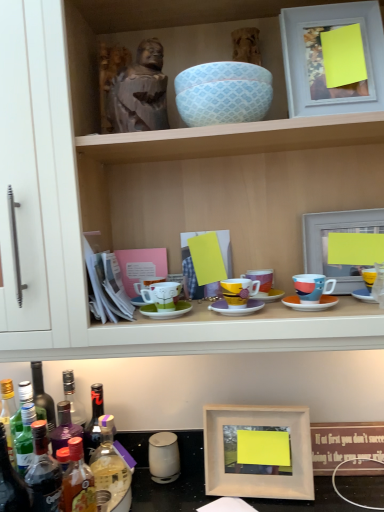
Find the location of `matte ceramic mug at right, which ranks as the 4th coffee cup in left-to-right order`. matte ceramic mug at right, which ranks as the 4th coffee cup in left-to-right order is located at coordinates (312, 287).

Describe the element at coordinates (112, 468) in the screenshot. This screenshot has height=512, width=384. I see `translucent plastic bottle at lower left, the first bottle viewed from the right` at that location.

Locate an element on the screen. wooden picture frame at right, the 3th picture frame in the bottom-to-top sequence is located at coordinates (343, 246).

Image resolution: width=384 pixels, height=512 pixels. What do you see at coordinates (220, 74) in the screenshot? I see `blue patterned bowl at upper center, the 2th bowl ordered from the bottom` at bounding box center [220, 74].

Measure the distance between purple matte saucer at center, marked as the 2th saucer in a right-to-left arrangement, and camera.

The depth of purple matte saucer at center, marked as the 2th saucer in a right-to-left arrangement, is 33.64 inches.

What is the approximate height of white glossy saucer at center, which is the third saucer from left to right?

white glossy saucer at center, which is the third saucer from left to right, is 0.48 inches in height.

At what (x,y) coordinates should I click in order to perform the action: click on white glossy saucer at center, marked as the 1th saucer in a right-to-left arrangement. Please return your answer as a coordinate pair (x, y). This screenshot has width=384, height=512. Looking at the image, I should click on (310, 303).

This screenshot has height=512, width=384. Describe the element at coordinates (231, 184) in the screenshot. I see `wooden statue at upper center` at that location.

Identify the location of matte ceramic mug at right, which ranks as the 4th coffee cup in left-to-right order. The height and width of the screenshot is (512, 384). (312, 287).

From a real-world perspective, which object stands above the other?

green matte coffee cup at center, the 4th coffee cup viewed from the right, is physically above.

Which object is wider, green matte coffee cup at center, the 4th coffee cup viewed from the right, or translucent plastic bottle at lower left, which is the 2th bottle from right to left?

Wider between the two is green matte coffee cup at center, the 4th coffee cup viewed from the right.

Is green matte coffee cup at center, the 1th coffee cup positioned from the left, inside or outside of translucent plastic bottle at lower left, which is the 2th bottle from right to left?

green matte coffee cup at center, the 1th coffee cup positioned from the left, is not inside translucent plastic bottle at lower left, which is the 2th bottle from right to left, it's outside.

Does green matte coffee cup at center, the 1th coffee cup positioned from the left, have a larger size compared to translucent plastic bottle at lower left, the 3th bottle when ordered from left to right?

Actually, green matte coffee cup at center, the 1th coffee cup positioned from the left, might be smaller than translucent plastic bottle at lower left, the 3th bottle when ordered from left to right.

Where is `the 2nd coffee cup positioned above the matte ceramic coffee cup at center, placed as the second coffee cup when sorted from left to right (from the image's perspective)`? This screenshot has height=512, width=384. the 2nd coffee cup positioned above the matte ceramic coffee cup at center, placed as the second coffee cup when sorted from left to right (from the image's perspective) is located at coordinates (261, 278).

Based on their sizes in the image, would you say matte ceramic coffee cup at center, the 3th coffee cup from the right, is bigger or smaller than matte purple coffee cup at center, the third coffee cup when ordered from left to right?

Considering their sizes, matte ceramic coffee cup at center, the 3th coffee cup from the right, takes up more space than matte purple coffee cup at center, the third coffee cup when ordered from left to right.

Between matte ceramic coffee cup at center, the 3th coffee cup from the right, and matte purple coffee cup at center, the second coffee cup in the right-to-left sequence, which one appears on the left side from the viewer's perspective?

Positioned to the left is matte ceramic coffee cup at center, the 3th coffee cup from the right.

From a real-world perspective, is matte ceramic coffee cup at center, the 3th coffee cup from the right, positioned over matte purple coffee cup at center, the second coffee cup in the right-to-left sequence, based on gravity?

Indeed, from a real-world perspective, matte ceramic coffee cup at center, the 3th coffee cup from the right, stands above matte purple coffee cup at center, the second coffee cup in the right-to-left sequence.

Does matte white picture frame at upper right, the first picture frame in the top-to-bottom sequence, appear on the right side of white glossy saucer at center, which is the third saucer from left to right?

Correct, you'll find matte white picture frame at upper right, the first picture frame in the top-to-bottom sequence, to the right of white glossy saucer at center, which is the third saucer from left to right.

Does matte white picture frame at upper right, the fourth picture frame when ordered from bottom to top, have a lesser height compared to white glossy saucer at center, marked as the 1th saucer in a right-to-left arrangement?

Incorrect, the height of matte white picture frame at upper right, the fourth picture frame when ordered from bottom to top, does not fall short of that of white glossy saucer at center, marked as the 1th saucer in a right-to-left arrangement.

Where is `the 2nd picture frame above the white glossy saucer at center, marked as the 1th saucer in a right-to-left arrangement (from the image's perspective)`? The image size is (384, 512). the 2nd picture frame above the white glossy saucer at center, marked as the 1th saucer in a right-to-left arrangement (from the image's perspective) is located at coordinates (322, 59).

Is matte white picture frame at upper right, the fourth picture frame when ordered from bottom to top, oriented away from white glossy saucer at center, marked as the 1th saucer in a right-to-left arrangement?

matte white picture frame at upper right, the fourth picture frame when ordered from bottom to top, is not turned away from white glossy saucer at center, marked as the 1th saucer in a right-to-left arrangement.

Consider the image. In the image, is matte ceramic coffee cup at center, placed as the second coffee cup when sorted from left to right, on the left side or the right side of matte ceramic mug at right, which is the 1th coffee cup in right-to-left order?

Based on their positions, matte ceramic coffee cup at center, placed as the second coffee cup when sorted from left to right, is located to the left of matte ceramic mug at right, which is the 1th coffee cup in right-to-left order.

Considering their positions, is matte ceramic coffee cup at center, placed as the second coffee cup when sorted from left to right, located in front of or behind matte ceramic mug at right, which is the 1th coffee cup in right-to-left order?

matte ceramic coffee cup at center, placed as the second coffee cup when sorted from left to right, is positioned closer to the viewer than matte ceramic mug at right, which is the 1th coffee cup in right-to-left order.

How far apart are matte ceramic coffee cup at center, placed as the second coffee cup when sorted from left to right, and matte ceramic mug at right, which is the 1th coffee cup in right-to-left order?

matte ceramic coffee cup at center, placed as the second coffee cup when sorted from left to right, is 4.68 inches away from matte ceramic mug at right, which is the 1th coffee cup in right-to-left order.

Based on the photo, is wooden picture frame at lower right, acting as the 1th picture frame starting from the bottom, positioned far away from wooden picture frame at lower center, placed as the third picture frame when sorted from top to bottom?

They are positioned close to each other.

Is wooden picture frame at lower right, the 4th picture frame from the top, to the left or to the right of wooden picture frame at lower center, placed as the third picture frame when sorted from top to bottom, in the image?

From the image, it's evident that wooden picture frame at lower right, the 4th picture frame from the top, is to the right of wooden picture frame at lower center, placed as the third picture frame when sorted from top to bottom.

The width and height of the screenshot is (384, 512). I want to click on picture frame below the wooden picture frame at lower center, placed as the third picture frame when sorted from top to bottom (from a real-world perspective), so click(344, 443).

Is wooden picture frame at lower right, the 4th picture frame from the top, wider than wooden picture frame at lower center, which is the second picture frame in bottom-to-top order?

In fact, wooden picture frame at lower right, the 4th picture frame from the top, might be narrower than wooden picture frame at lower center, which is the second picture frame in bottom-to-top order.

Do you think purple matte saucer at center, which is the 2th saucer from left to right, is within matte ceramic coffee cup at center, placed as the second coffee cup when sorted from left to right, or outside of it?

purple matte saucer at center, which is the 2th saucer from left to right, is not inside matte ceramic coffee cup at center, placed as the second coffee cup when sorted from left to right, it's outside.

Who is more distant, purple matte saucer at center, marked as the 2th saucer in a right-to-left arrangement, or matte ceramic coffee cup at center, placed as the second coffee cup when sorted from left to right?

matte ceramic coffee cup at center, placed as the second coffee cup when sorted from left to right, is behind.

Between purple matte saucer at center, marked as the 2th saucer in a right-to-left arrangement, and matte ceramic coffee cup at center, the 3th coffee cup from the right, which one has larger size?

With larger size is matte ceramic coffee cup at center, the 3th coffee cup from the right.

From the image's perspective, is translucent plastic bottle at lower left, the 3th bottle positioned from the right, over matte ceramic coffee cup at center, the 3th coffee cup from the right?

No, from the image's perspective, translucent plastic bottle at lower left, the 3th bottle positioned from the right, is not on top of matte ceramic coffee cup at center, the 3th coffee cup from the right.

Who is shorter, translucent plastic bottle at lower left, placed as the second bottle when sorted from left to right, or matte ceramic coffee cup at center, the 3th coffee cup from the right?

matte ceramic coffee cup at center, the 3th coffee cup from the right, is shorter.

There is a matte ceramic coffee cup at center, placed as the second coffee cup when sorted from left to right. Identify the location of the 1st bottle below it (from the image's perspective). [x=44, y=473].

Which object is more forward, translucent plastic bottle at lower left, the 3th bottle positioned from the right, or matte ceramic coffee cup at center, placed as the second coffee cup when sorted from left to right?

Positioned in front is translucent plastic bottle at lower left, the 3th bottle positioned from the right.

From the translucent plastic bottle at lower left, the 3th bottle when ordered from left to right, count 3rd coffee cups backward and point to it. Please provide its 2D coordinates.

[(162, 295)]

The height and width of the screenshot is (512, 384). I want to click on the 2nd coffee cup above the matte ceramic coffee cup at center, the 3th coffee cup from the right (from the image's perspective), so click(x=261, y=278).

Based on their spatial positions, is blue patterned bowl at upper center, the 2th bowl ordered from the bottom, or wooden picture frame at lower right, the 4th picture frame from the top, further from white glossy saucer at center, which is the third saucer from left to right?

Based on the image, wooden picture frame at lower right, the 4th picture frame from the top, appears to be further to white glossy saucer at center, which is the third saucer from left to right.

Estimate the real-world distances between objects in this image. Which object is further from translucent plastic bottle at lower left, the 3th bottle when ordered from left to right, white glossy saucer at center, marked as the 1th saucer in a right-to-left arrangement, or matte purple coffee cup at center, the second coffee cup in the right-to-left sequence?

white glossy saucer at center, marked as the 1th saucer in a right-to-left arrangement, is further to translucent plastic bottle at lower left, the 3th bottle when ordered from left to right.

From the image, which object appears to be farther from translucent plastic bottle at lower left, the first bottle viewed from the right, wooden picture frame at lower right, the 4th picture frame from the top, or blue patterned bowl at upper center, the first bowl when ordered from bottom to top?

blue patterned bowl at upper center, the first bowl when ordered from bottom to top.

Looking at the image, which one is located further to matte ceramic coffee cup at center, placed as the second coffee cup when sorted from left to right, white glossy saucer at center, which is the third saucer from left to right, or wooden statue at upper center?

wooden statue at upper center is further to matte ceramic coffee cup at center, placed as the second coffee cup when sorted from left to right.

Which object lies further to the anchor point wooden picture frame at right, which ranks as the second picture frame in top-to-bottom order, purple matte saucer at center, which is the 2th saucer from left to right, or green matte coffee cup at center, the 4th coffee cup viewed from the right?

green matte coffee cup at center, the 4th coffee cup viewed from the right, is positioned further to the anchor wooden picture frame at right, which ranks as the second picture frame in top-to-bottom order.

Which object lies nearer to the anchor point translucent plastic bottle at lower left, which is the 2th bottle from right to left, translucent plastic bottle at lower left, the 4th bottle when ordered from left to right, or purple matte saucer at center, which is the 2th saucer from left to right?

translucent plastic bottle at lower left, the 4th bottle when ordered from left to right, lies closer to translucent plastic bottle at lower left, which is the 2th bottle from right to left, than the other object.

From the image, which object appears to be farther from green matte saucer at center, which is counted as the third saucer, starting from the right, wooden picture frame at lower center, placed as the third picture frame when sorted from top to bottom, or wooden statue at upper center?

wooden picture frame at lower center, placed as the third picture frame when sorted from top to bottom, is positioned further to the anchor green matte saucer at center, which is counted as the third saucer, starting from the right.

Based on the photo, from the image, which object appears to be nearer to wooden picture frame at lower right, the 4th picture frame from the top, translucent plastic bottle at lower left, placed as the second bottle when sorted from left to right, or matte white picture frame at upper right, the first picture frame in the top-to-bottom sequence?

Based on the image, translucent plastic bottle at lower left, placed as the second bottle when sorted from left to right, appears to be nearer to wooden picture frame at lower right, the 4th picture frame from the top.

Where is `bottle between translucent plastic bottle at lower left, the 3th bottle when ordered from left to right, and white glossy saucer at center, which is the third saucer from left to right, from left to right`? The image size is (384, 512). bottle between translucent plastic bottle at lower left, the 3th bottle when ordered from left to right, and white glossy saucer at center, which is the third saucer from left to right, from left to right is located at coordinates (112, 468).

This screenshot has width=384, height=512. Identify the location of bowl between blue patterned bowl at upper center, the 2th bowl ordered from the bottom, and translucent plastic bottle at lower left, the first bottle viewed from the right, from top to bottom. (224, 102).

Identify the location of picture frame between translucent plastic bottle at lower left, the 3th bottle positioned from the right, and white glossy saucer at center, which is the third saucer from left to right, in the horizontal direction. (258, 452).

In order to click on saucer that lies between purple matte saucer at center, marked as the 2th saucer in a right-to-left arrangement, and translucent plastic bottle at lower left, the 3th bottle positioned from the right, from top to bottom in this screenshot , I will do `click(166, 311)`.